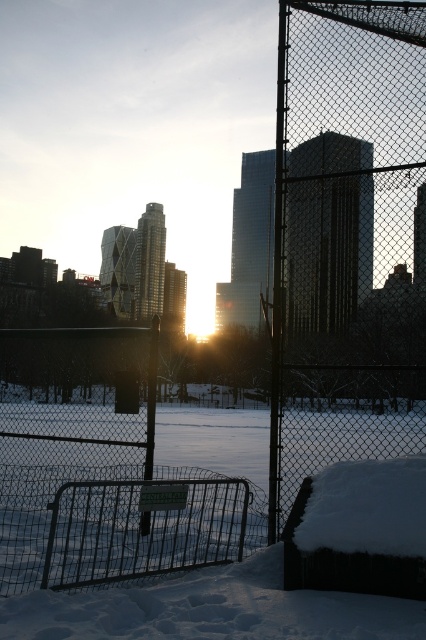
Describe the element at coordinates (347, 237) in the screenshot. I see `wire mesh fence at center` at that location.

Can you confirm if wire mesh fence at center is wider than metallic chain-link fence at center?

No.

Who is more forward, (x=319, y=248) or (x=71, y=432)?

Point (x=319, y=248)

I want to click on wire mesh fence at center, so click(x=347, y=237).